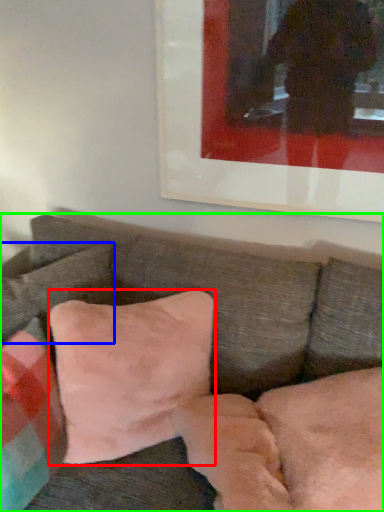
Question: Which object is the farthest from pillow (highlighted by a red box)? Choose among these: pillow (highlighted by a blue box) or studio couch (highlighted by a green box).

Choices:
 (A) pillow
 (B) studio couch

Answer: (A)